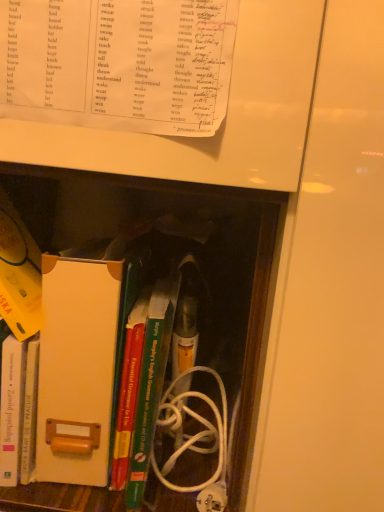
Question: From the image's perspective, is green hardcover book at center, the fourth book when ordered from top to bottom, over green matte book at center, which appears as the 2th book when viewed from the top?

Choices:
 (A) yes
 (B) no

Answer: (B)

Question: Does green hardcover book at center, which is counted as the second book, starting from the bottom, appear on the right side of green matte book at center, which appears as the 2th book when viewed from the top?

Choices:
 (A) no
 (B) yes

Answer: (A)

Question: Is green hardcover book at center, which is counted as the second book, starting from the bottom, oriented away from green matte book at center, which appears as the 2th book when viewed from the top?

Choices:
 (A) yes
 (B) no

Answer: (A)

Question: Can you confirm if green hardcover book at center, the fourth book when ordered from top to bottom, is thinner than green matte book at center, which appears as the 2th book when viewed from the top?

Choices:
 (A) yes
 (B) no

Answer: (A)

Question: Could you tell me if green hardcover book at center, the fourth book when ordered from top to bottom, is facing green matte book at center, the 4th book in the bottom-to-top sequence?

Choices:
 (A) yes
 (B) no

Answer: (A)

Question: Is green hardcover book at center, the fourth book when ordered from top to bottom, located outside green matte book at center, the 4th book in the bottom-to-top sequence?

Choices:
 (A) yes
 (B) no

Answer: (B)

Question: Is white paper at upper center, the 5th book positioned from the bottom, smaller than white cardboard file at center?

Choices:
 (A) no
 (B) yes

Answer: (B)

Question: Does white paper at upper center, the 1th book positioned from the top, have a greater width compared to white cardboard file at center?

Choices:
 (A) yes
 (B) no

Answer: (B)

Question: Is white paper at upper center, the 1th book positioned from the top, closer to camera compared to white cardboard file at center?

Choices:
 (A) yes
 (B) no

Answer: (A)

Question: Could white cardboard file at center be considered to be inside white paper at upper center, the 1th book positioned from the top?

Choices:
 (A) no
 (B) yes

Answer: (A)

Question: From the image's perspective, is white paper at upper center, the 1th book positioned from the top, on white cardboard file at center?

Choices:
 (A) no
 (B) yes

Answer: (B)

Question: Does white paper at upper center, the 5th book positioned from the bottom, have a larger size compared to white cardboard file at center?

Choices:
 (A) no
 (B) yes

Answer: (A)

Question: Would you consider white cardboard file at center to be distant from green matte book at center, the 4th book in the bottom-to-top sequence?

Choices:
 (A) no
 (B) yes

Answer: (A)